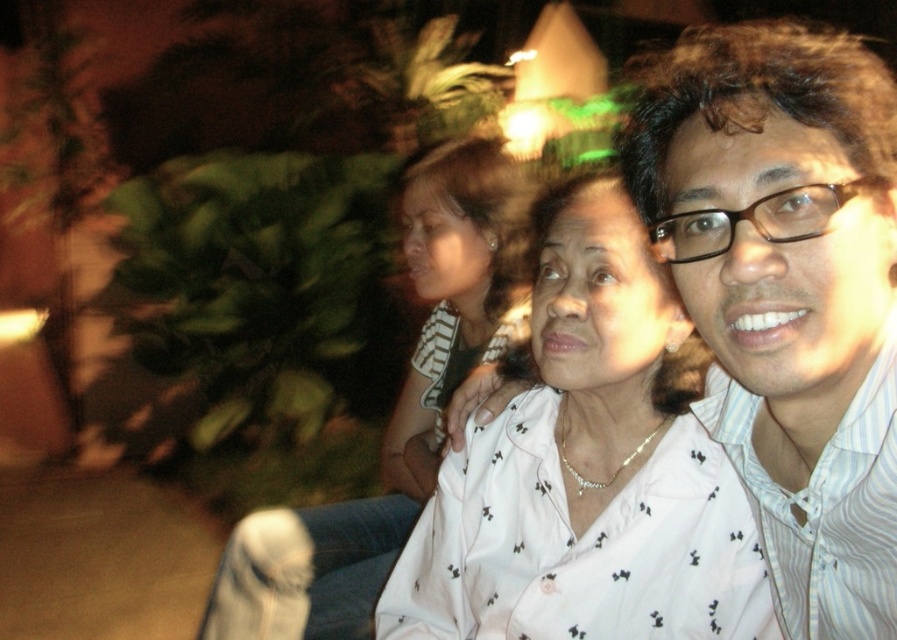
This screenshot has width=897, height=640. I want to click on white printed blouse at center, so click(588, 472).

Image resolution: width=897 pixels, height=640 pixels. What do you see at coordinates (588, 472) in the screenshot?
I see `white printed blouse at center` at bounding box center [588, 472].

Where is `white printed blouse at center`? white printed blouse at center is located at coordinates (588, 472).

Who is positioned more to the right, white printed shirt at center or white striped shirt at right?

From the viewer's perspective, white striped shirt at right appears more on the right side.

Does white printed shirt at center have a greater height compared to white striped shirt at right?

Yes.

Between point (268, 634) and point (826, 596), which one is positioned in front?

Positioned in front is point (826, 596).

Locate an element on the screen. white printed shirt at center is located at coordinates (392, 412).

Between point (832, 93) and point (471, 320), which one is positioned in front?

Point (832, 93)

Describe the element at coordinates (788, 292) in the screenshot. I see `white striped shirt at center` at that location.

The image size is (897, 640). In order to click on white striped shirt at center in this screenshot , I will do `click(788, 292)`.